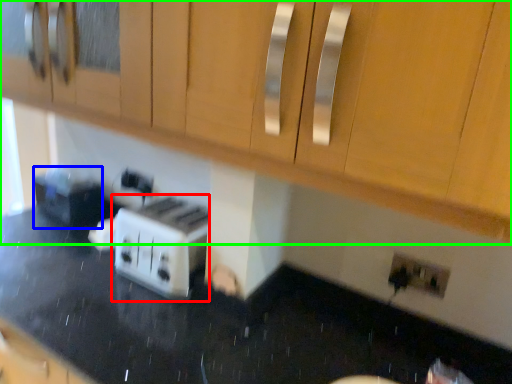
Question: Which object is positioned closest to toaster (highlighted by a red box)? Select from appliance (highlighted by a blue box) and cabinetry (highlighted by a green box).

Choices:
 (A) appliance
 (B) cabinetry

Answer: (B)